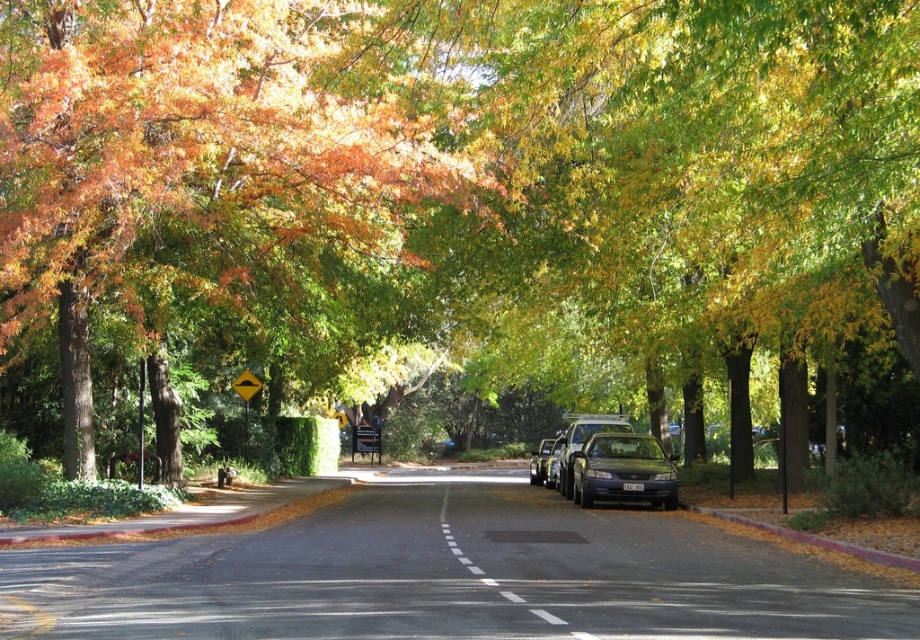
Who is taller, metallic gray sedan at center or yellow reflective plastic triangle at center?

Standing taller between the two is metallic gray sedan at center.

Is metallic gray sedan at center to the left of yellow reflective plastic triangle at center from the viewer's perspective?

No, metallic gray sedan at center is not to the left of yellow reflective plastic triangle at center.

This screenshot has height=640, width=920. I want to click on metallic gray sedan at center, so click(624, 470).

Does point (240, 380) come closer to viewer compared to point (532, 472)?

Yes, point (240, 380) is closer to viewer.

Can you confirm if yellow reflective plastic triangle at upper center is smaller than shiny black sedan at center?

Correct, yellow reflective plastic triangle at upper center occupies less space than shiny black sedan at center.

Is point (237, 381) positioned in front of point (539, 449)?

Yes.

This screenshot has height=640, width=920. Find the location of `yellow reflective plastic triangle at upper center`. yellow reflective plastic triangle at upper center is located at coordinates (246, 397).

Can you confirm if black asphalt road at center is bigger than yellow reflective plastic triangle at center?

Yes.

Where is `black asphalt road at center`? black asphalt road at center is located at coordinates (484, 570).

Is point (453, 536) positioned after point (247, 388)?

No, it is in front of (247, 388).

The image size is (920, 640). I want to click on black asphalt road at center, so click(x=484, y=570).